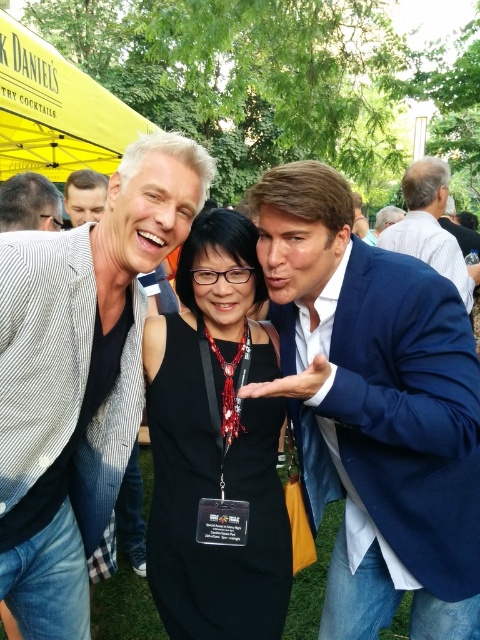
Question: Estimate the real-world distances between objects in this image. Which object is farther from the yellow fabric canopy at upper left?

Choices:
 (A) blue suit at upper right
 (B) black satin dress at center

Answer: (B)

Question: Does black satin dress at center have a greater width compared to matte black shirt at left?

Choices:
 (A) no
 (B) yes

Answer: (B)

Question: Which object is the closest to the blue satin suit at center?

Choices:
 (A) yellow fabric canopy at upper left
 (B) blue suit at upper right
 (C) matte black suit at center

Answer: (C)

Question: Estimate the real-world distances between objects in this image. Which object is closer to the yellow fabric canopy at upper left?

Choices:
 (A) matte black suit at center
 (B) black satin dress at center

Answer: (B)

Question: Is matte black shirt at left positioned before matte black hair at upper left?

Choices:
 (A) yes
 (B) no

Answer: (A)

Question: Is matte black shirt at left positioned in front of matte black hair at upper left?

Choices:
 (A) no
 (B) yes

Answer: (B)